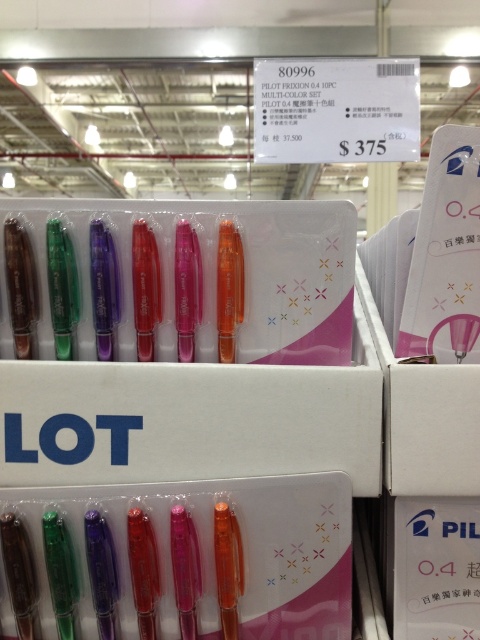
You are standing in front of the retail display of Pilot Frixion pens. You notice two points marked on the display. The first point is at coordinates point (155, 312) and the second is at point (287, 577). Which point is closer to you?

Point (155, 312) is in front of point (287, 577), so the first point is closer to you.

You are a customer looking at the Pilot Frixion 0.4 Multi Color pens displayed in a white cardboard box. You notice two groups of translucent plastic pens at center and translucent plastic pens at lower center. Which group of pens is taller?

The translucent plastic pens at center has a greater height compared to the translucent plastic pens at lower center.

You are standing at a store and see the retail display with Pilot Frixion 0.4 Multi Color pens. You want to pick up the pen at point (x=301, y=406). If your hand can reach up to 30 inches, will you be able to reach it?

The point (x=301, y=406) is 35.83 inches away from the camera, which is beyond your hand reach of 30 inches. Therefore, you cannot reach the pen at point (x=301, y=406).